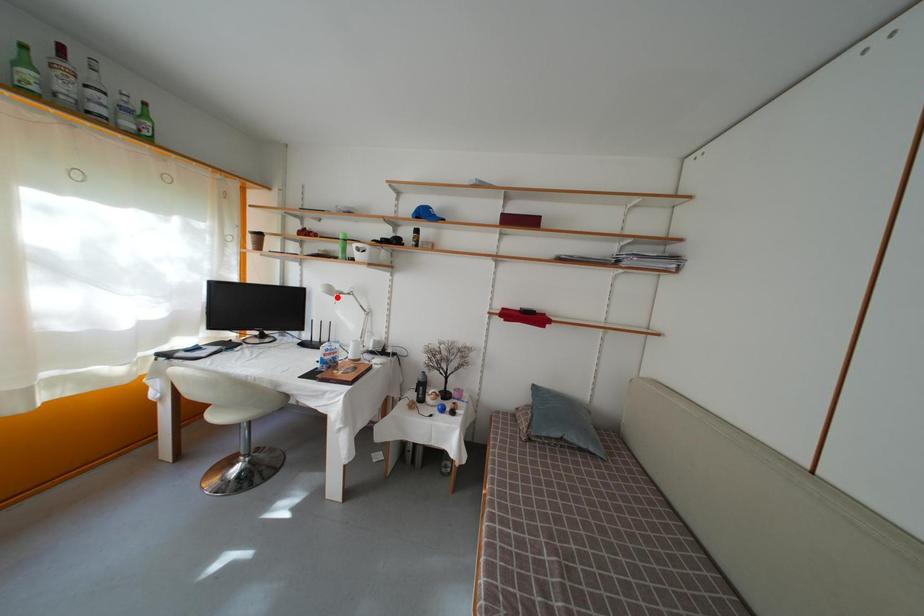
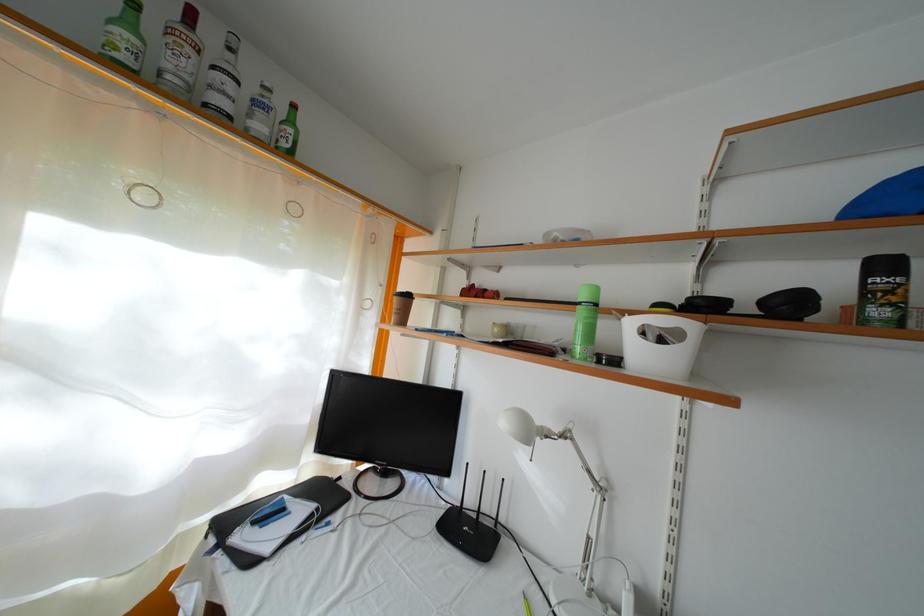
In the second image, find the point that corresponds to the highlighted location in the first image.

(535, 439)